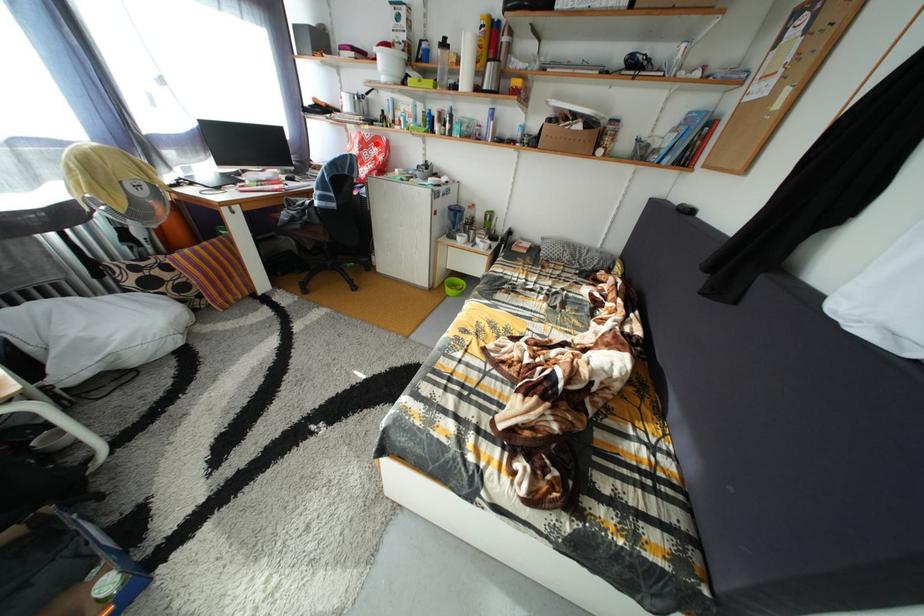
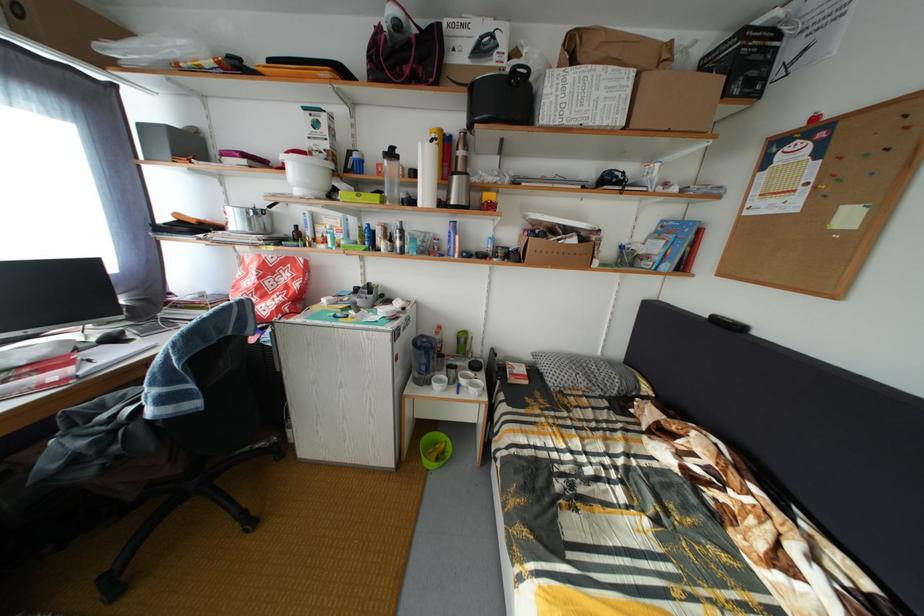
Find the pixel in the second image that matches the highlighted location in the first image.

(281, 267)